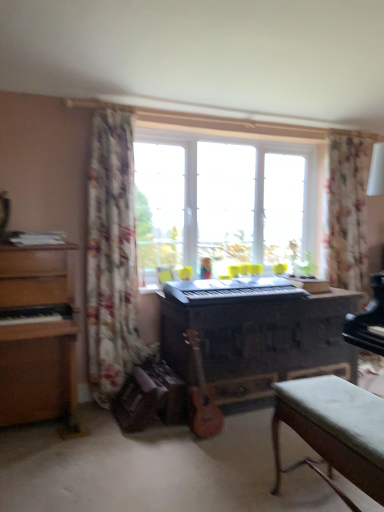
Question: From a real-world perspective, is wooden acoustic guitar at center positioned under floral fabric curtain at left, which ranks as the first curtain in left-to-right order, based on gravity?

Choices:
 (A) no
 (B) yes

Answer: (B)

Question: Is the position of wooden acoustic guitar at center more distant than that of floral fabric curtain at left, which ranks as the first curtain in left-to-right order?

Choices:
 (A) no
 (B) yes

Answer: (A)

Question: Does wooden acoustic guitar at center contain floral fabric curtain at left, which ranks as the first curtain in left-to-right order?

Choices:
 (A) no
 (B) yes

Answer: (A)

Question: Can you confirm if wooden acoustic guitar at center is shorter than floral fabric curtain at left, which appears as the first curtain when viewed from the front?

Choices:
 (A) yes
 (B) no

Answer: (A)

Question: Considering the relative sizes of wooden acoustic guitar at center and floral fabric curtain at left, which ranks as the first curtain in left-to-right order, in the image provided, is wooden acoustic guitar at center smaller than floral fabric curtain at left, which ranks as the first curtain in left-to-right order,?

Choices:
 (A) yes
 (B) no

Answer: (A)

Question: From the image's perspective, is wooden acoustic guitar at center below floral fabric curtain at left, which ranks as the first curtain in left-to-right order?

Choices:
 (A) yes
 (B) no

Answer: (A)

Question: Is the depth of transparent glass window at center less than that of floral fabric curtain at upper right, which appears as the second curtain when viewed from the left?

Choices:
 (A) yes
 (B) no

Answer: (B)

Question: Can you confirm if transparent glass window at center is positioned to the right of floral fabric curtain at upper right, marked as the 2th curtain in a front-to-back arrangement?

Choices:
 (A) yes
 (B) no

Answer: (B)

Question: Does transparent glass window at center come behind floral fabric curtain at upper right, marked as the 2th curtain in a front-to-back arrangement?

Choices:
 (A) yes
 (B) no

Answer: (A)

Question: Can you confirm if transparent glass window at center is positioned to the left of floral fabric curtain at upper right, marked as the 2th curtain in a front-to-back arrangement?

Choices:
 (A) no
 (B) yes

Answer: (B)

Question: From a real-world perspective, is transparent glass window at center under floral fabric curtain at upper right, which appears as the first curtain when viewed from the back?

Choices:
 (A) no
 (B) yes

Answer: (B)

Question: From the image's perspective, is transparent glass window at center on top of floral fabric curtain at upper right, which appears as the second curtain when viewed from the left?

Choices:
 (A) yes
 (B) no

Answer: (B)

Question: Is black plastic keyboard at center outside transparent glass window at center?

Choices:
 (A) no
 (B) yes

Answer: (B)